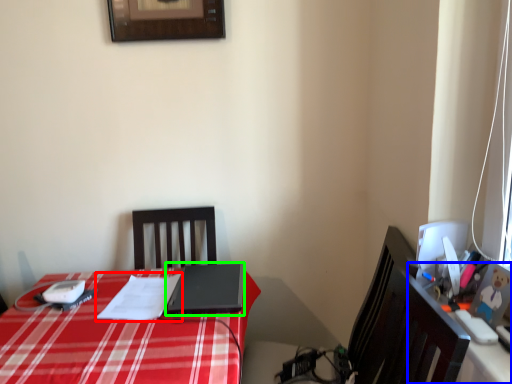
Question: Which object is positioned farthest from notepad (highlighted by a red box)? Select from computer desk (highlighted by a blue box) and laptop (highlighted by a green box).

Choices:
 (A) computer desk
 (B) laptop

Answer: (A)